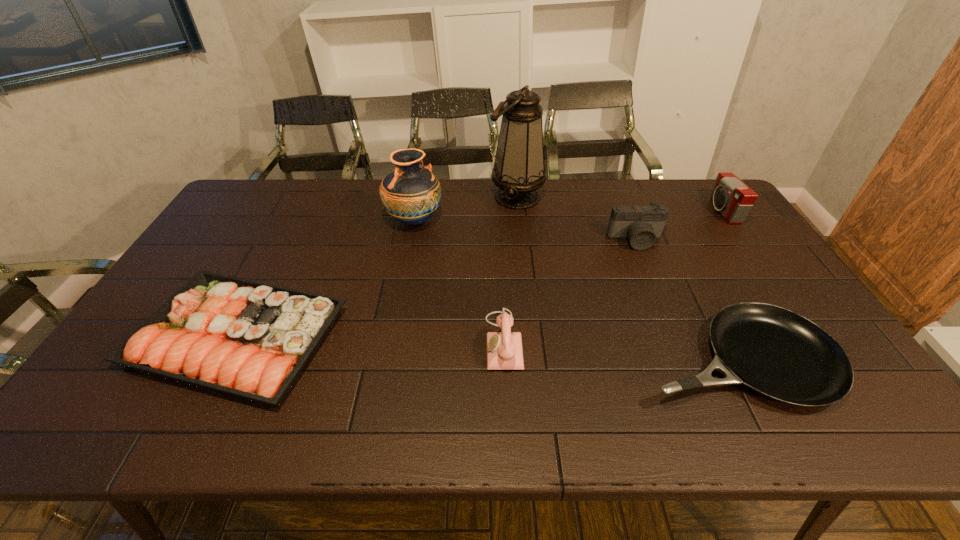
Identify the location of free space that is in between the telephone and the left camera. (569, 291).

You are a GUI agent. You are given a task and a screenshot of the screen. Output one action in this format:
    pyautogui.click(x=<x>, y=<y>)
    Task: Click on the free space that is in between the telephone and the left camera
    Image resolution: width=960 pixels, height=540 pixels.
    Given the screenshot: What is the action you would take?
    pyautogui.click(x=569, y=291)

Image resolution: width=960 pixels, height=540 pixels. Find the location of `free spot between the oil lamp and the platter`. free spot between the oil lamp and the platter is located at coordinates (377, 267).

Where is `vacant region between the pan and the oil lamp`? vacant region between the pan and the oil lamp is located at coordinates (626, 278).

Identify which object is the closest to the telephone. Please provide its 2D coordinates. Your answer should be formatted as a tuple, i.e. [(x, y)], where the tuple contains the x and y coordinates of a point satisfying the conditions above.

[(773, 351)]

Choose which object is the nearest neighbor to the platter. Please provide its 2D coordinates. Your answer should be formatted as a tuple, i.e. [(x, y)], where the tuple contains the x and y coordinates of a point satisfying the conditions above.

[(411, 194)]

The height and width of the screenshot is (540, 960). Find the location of `free space that satisfies the following two spatial constraints: 1. on the front-facing side of the right camera; 2. on the front side of the pan`. free space that satisfies the following two spatial constraints: 1. on the front-facing side of the right camera; 2. on the front side of the pan is located at coordinates (x=826, y=359).

Where is `vacant region that satisfies the following two spatial constraints: 1. on the dial of the pan; 2. on the right side of the telephone`? vacant region that satisfies the following two spatial constraints: 1. on the dial of the pan; 2. on the right side of the telephone is located at coordinates (504, 359).